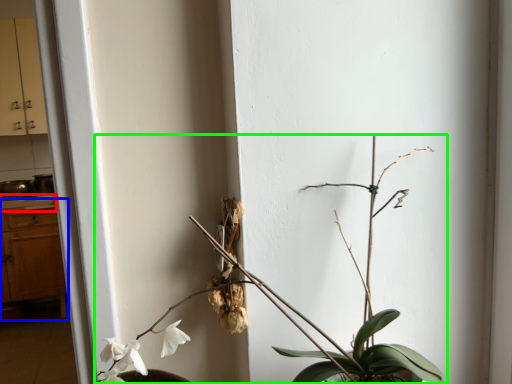
Question: Which object is the farthest from counter top (highlighted by a red box)? Choose among these: dresser (highlighted by a blue box) or houseplant (highlighted by a green box).

Choices:
 (A) dresser
 (B) houseplant

Answer: (B)